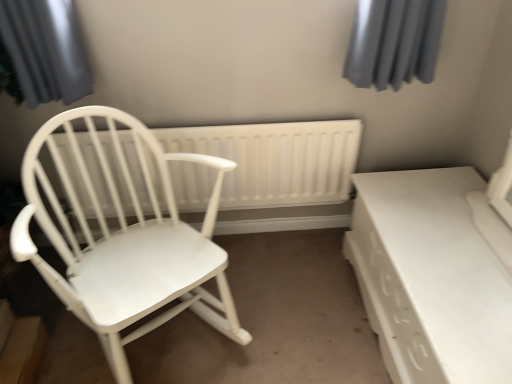
What do you see at coordinates (276, 160) in the screenshot? The width and height of the screenshot is (512, 384). I see `white plastic radiator at center` at bounding box center [276, 160].

In order to face white matte wood chair at left, should I rotate leftwards or rightwards?

To align with it, rotate left about 17.183°.

Where is `white matte wood chair at left`? white matte wood chair at left is located at coordinates (124, 234).

Where is `white glossy table at lower right`? This screenshot has height=384, width=512. white glossy table at lower right is located at coordinates (430, 277).

Does point (198, 204) lie in front of point (178, 241)?

No, (198, 204) is behind (178, 241).

Who is bigger, white plastic radiator at center or white matte wood chair at left?

white matte wood chair at left.

Considering the sizes of objects white plastic radiator at center and white matte wood chair at left in the image provided, who is thinner, white plastic radiator at center or white matte wood chair at left?

white plastic radiator at center.

Which is correct: white plastic radiator at center is inside white matte wood chair at left, or outside of it?

white plastic radiator at center lies outside white matte wood chair at left.

Which object is further away from the camera taking this photo, white glossy table at lower right or white matte wood chair at left?

Positioned behind is white glossy table at lower right.

Between white glossy table at lower right and white matte wood chair at left, which one has less height?

Standing shorter between the two is white glossy table at lower right.

What's the angular difference between white glossy table at lower right and white matte wood chair at left's facing directions?

The facing directions of white glossy table at lower right and white matte wood chair at left are 124 degrees apart.

From the picture: From the image's perspective, is white glossy table at lower right above or below white matte wood chair at left?

Based on their image positions, white glossy table at lower right is located beneath white matte wood chair at left.

The width and height of the screenshot is (512, 384). What are the coordinates of `chair in front of the white glossy table at lower right` in the screenshot? It's located at (124, 234).

Is white matte wood chair at left to the left of white glossy table at lower right from the viewer's perspective?

Correct, you'll find white matte wood chair at left to the left of white glossy table at lower right.

Which object is wider, white matte wood chair at left or white glossy table at lower right?

With larger width is white matte wood chair at left.

Is point (154, 308) less distant than point (434, 270)?

Yes, it is.

Which is in front, white matte wood chair at left or white plastic radiator at center?

Positioned in front is white matte wood chair at left.

From a real-world perspective, is white matte wood chair at left physically located above or below white plastic radiator at center?

white matte wood chair at left is situated higher than white plastic radiator at center in the real world.

Is white matte wood chair at left touching white plastic radiator at center?

No, white matte wood chair at left is not beside white plastic radiator at center.

Is white matte wood chair at left to the left of white plastic radiator at center from the viewer's perspective?

Correct, you'll find white matte wood chair at left to the left of white plastic radiator at center.

Would you say white glossy table at lower right is part of white plastic radiator at center's contents?

No, white glossy table at lower right is not surrounded by white plastic radiator at center.

Can you confirm if white plastic radiator at center is positioned to the right of white glossy table at lower right?

No, white plastic radiator at center is not to the right of white glossy table at lower right.

Is white plastic radiator at center next to white glossy table at lower right?

No.

What are the coordinates of `radiator behind the white glossy table at lower right` in the screenshot? It's located at (276, 160).

This screenshot has width=512, height=384. What are the coordinates of `radiator above the white glossy table at lower right (from the image's perspective)` in the screenshot? It's located at (276, 160).

Which is more to the right, white glossy table at lower right or white plastic radiator at center?

white glossy table at lower right is more to the right.

Between white glossy table at lower right and white plastic radiator at center, which one has more height?

Standing taller between the two is white plastic radiator at center.

Based on the photo, who is more distant, white glossy table at lower right or white plastic radiator at center?

white plastic radiator at center is further away from the camera.

You are a GUI agent. You are given a task and a screenshot of the screen. Output one action in this format:
    pyautogui.click(x=<x>, y=<y>)
    Task: Click on the chair above the white plastic radiator at center (from a real-world perspective)
    This screenshot has height=384, width=512.
    Given the screenshot: What is the action you would take?
    pyautogui.click(x=124, y=234)

Locate an element on the screen. table below the white matte wood chair at left (from the image's perspective) is located at coordinates (430, 277).

Considering their positions, is white plastic radiator at center positioned closer to white matte wood chair at left than white glossy table at lower right?

white plastic radiator at center is closer to white matte wood chair at left.

Estimate the real-world distances between objects in this image. Which object is closer to white glossy table at lower right, white matte wood chair at left or white plastic radiator at center?

The object closer to white glossy table at lower right is white plastic radiator at center.

From the image, which object appears to be nearer to white matte wood chair at left, white glossy table at lower right or white plastic radiator at center?

The object closer to white matte wood chair at left is white plastic radiator at center.

Considering their positions, is white matte wood chair at left positioned closer to white plastic radiator at center than white glossy table at lower right?

Based on the image, white matte wood chair at left appears to be nearer to white plastic radiator at center.

From the image, which object appears to be nearer to white plastic radiator at center, white glossy table at lower right or white matte wood chair at left?

Based on the image, white matte wood chair at left appears to be nearer to white plastic radiator at center.

From the image, which object appears to be farther from white glossy table at lower right, white plastic radiator at center or white matte wood chair at left?

white matte wood chair at left.

Where is `radiator between white matte wood chair at left and white glossy table at lower right from left to right`? radiator between white matte wood chair at left and white glossy table at lower right from left to right is located at coordinates (276, 160).